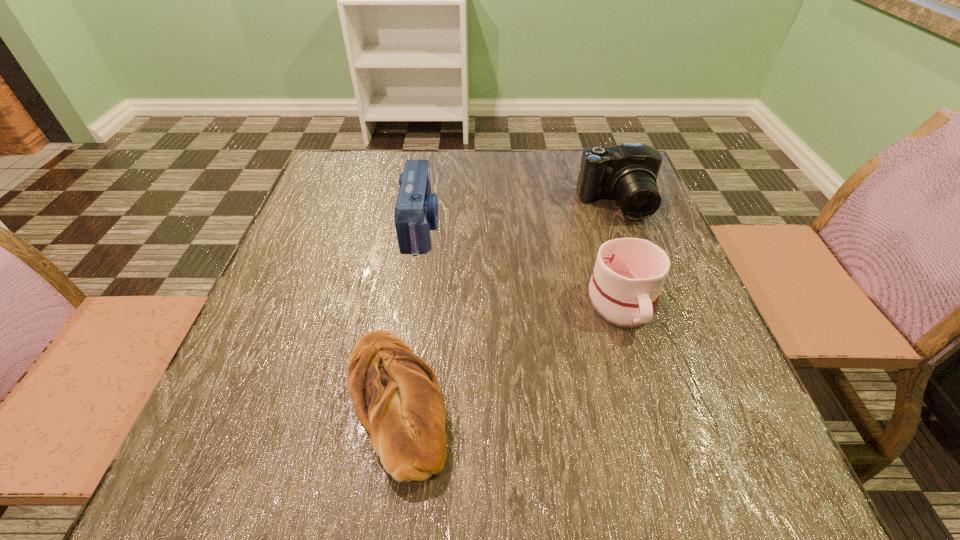
I want to click on camera that is at the right edge, so click(627, 173).

Image resolution: width=960 pixels, height=540 pixels. I want to click on mug that is at the right edge, so click(629, 273).

Identify the location of object at the far right corner. The image size is (960, 540). (627, 173).

This screenshot has width=960, height=540. I want to click on vacant space at the far edge of the desktop, so click(545, 166).

This screenshot has width=960, height=540. I want to click on vacant region at the left edge of the desktop, so click(x=285, y=300).

Locate an element on the screen. blank space at the right edge is located at coordinates (713, 373).

What are the coordinates of `blank space at the far left corner of the desktop` in the screenshot? It's located at (359, 183).

In the image, there is a desktop. Identify the location of vacant space at the near left corner. (180, 501).

Find the location of a particular element. The image size is (960, 540). vacant space at the near right corner of the desktop is located at coordinates (766, 499).

Locate an element on the screen. empty space between the shortest object and the right camera is located at coordinates (506, 303).